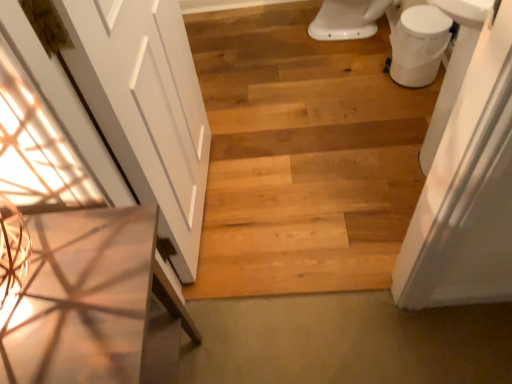
Find the location of a particular element. free space in front of white glossy toilet bowl at upper right is located at coordinates (410, 105).